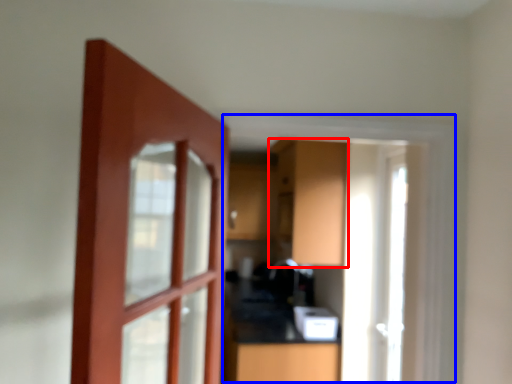
Question: Which point is closer to the camera, cabinetry (highlighted by a red box) or window frame (highlighted by a blue box)?

Choices:
 (A) cabinetry
 (B) window frame

Answer: (B)